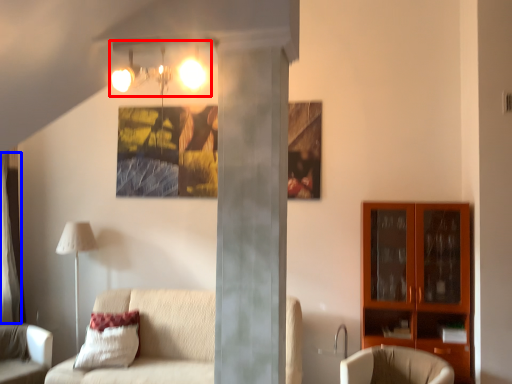
Question: Which object appears closest to the camera in this image, light fixture (highlighted by a red box) or curtain (highlighted by a blue box)?

Choices:
 (A) light fixture
 (B) curtain

Answer: (A)